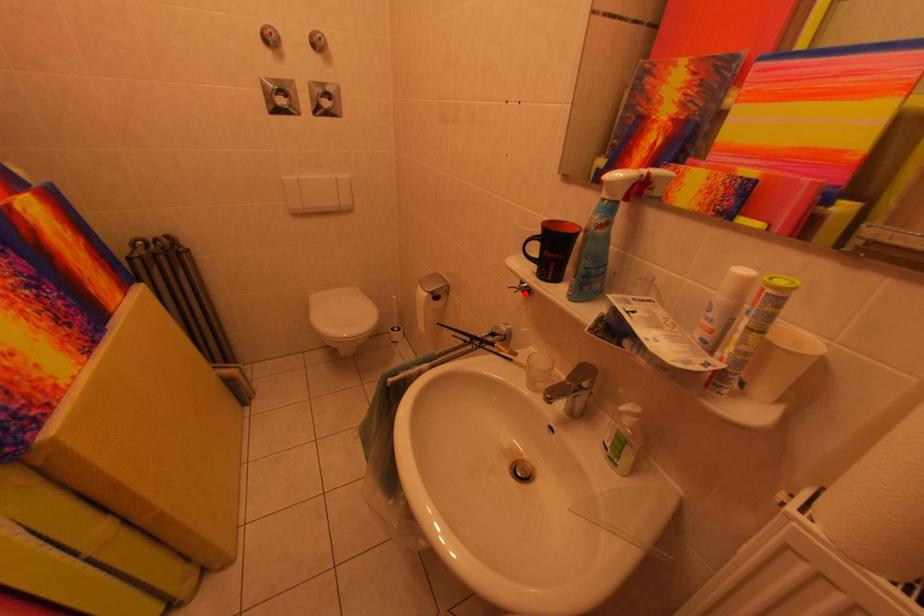
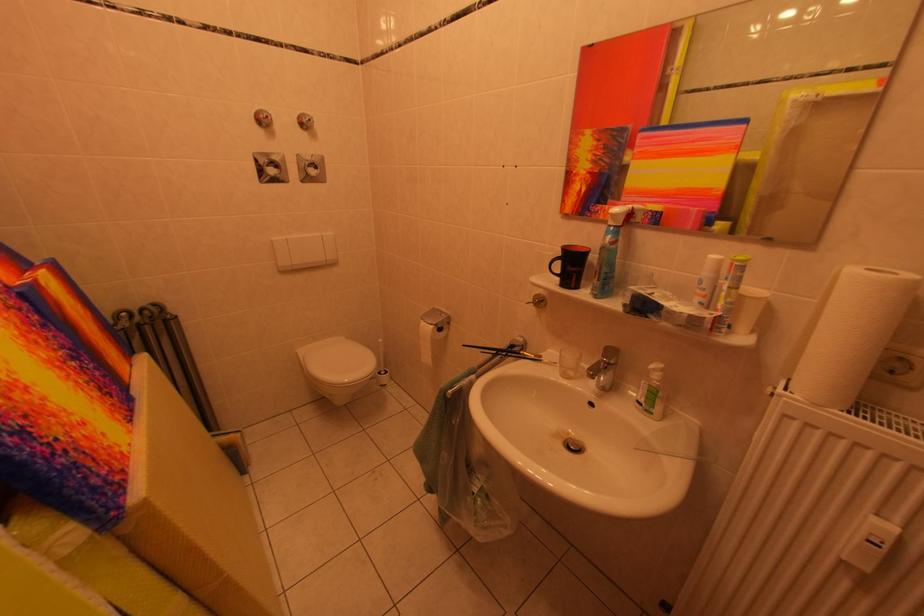
In the second image, find the point that corresponds to the highlighted location in the first image.

(541, 308)